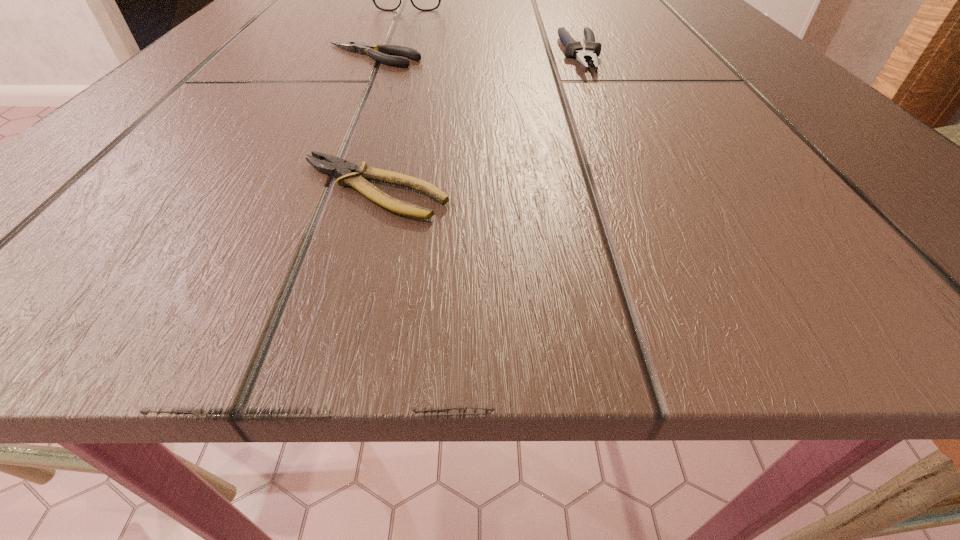
Where is `vacant space at the far right corner`? vacant space at the far right corner is located at coordinates 676,4.

This screenshot has height=540, width=960. What are the coordinates of `vacant region at the near right corner of the desktop` in the screenshot? It's located at (887, 286).

In order to click on free space between the rightmost object and the shortest object in this screenshot , I will do `click(477, 122)`.

Where is `unoccupied area between the nearest pliers and the second tallest object`? unoccupied area between the nearest pliers and the second tallest object is located at coordinates (477, 122).

Select which object is the second closest to the farthest object. Please provide its 2D coordinates. Your answer should be formatted as a tuple, i.e. [(x, y)], where the tuple contains the x and y coordinates of a point satisfying the conditions above.

[(573, 48)]

This screenshot has width=960, height=540. In order to click on the closest object to the third shortest object in this screenshot , I will do `click(379, 53)`.

Where is `pliers that is the closest to the third shortest object`? The image size is (960, 540). pliers that is the closest to the third shortest object is located at coordinates (379, 53).

Locate an element on the screen. The height and width of the screenshot is (540, 960). the second closest pliers to the rightmost pliers is located at coordinates (350, 175).